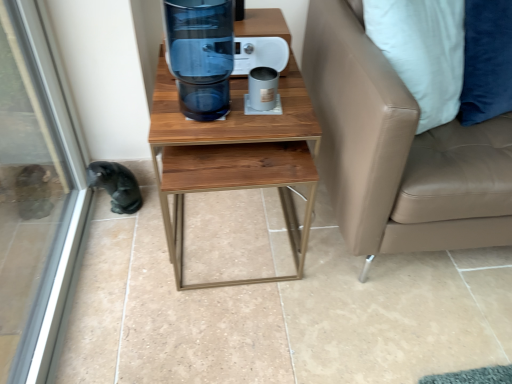
In order to click on blank space situated above wooden table at center (from a real-world perspective) in this screenshot , I will do `click(225, 99)`.